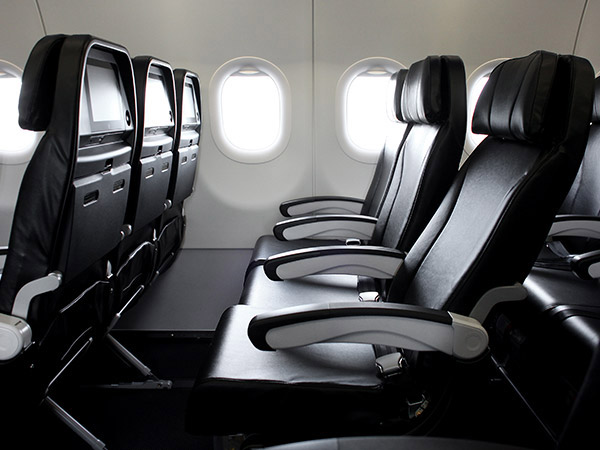
The image size is (600, 450). In order to click on armrests in this screenshot , I will do `click(17, 331)`, `click(6, 263)`, `click(396, 331)`, `click(337, 244)`, `click(313, 215)`, `click(337, 202)`, `click(579, 228)`, `click(590, 266)`.